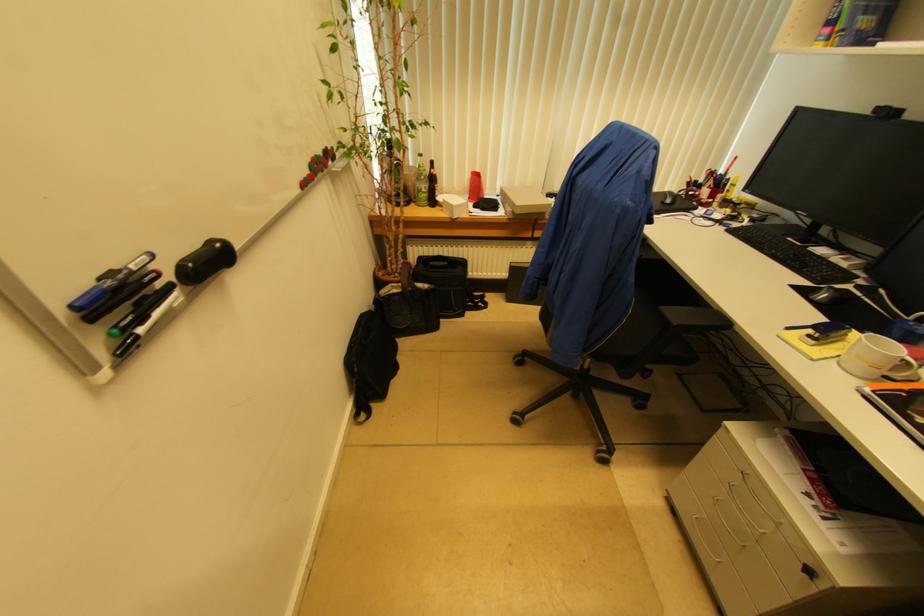
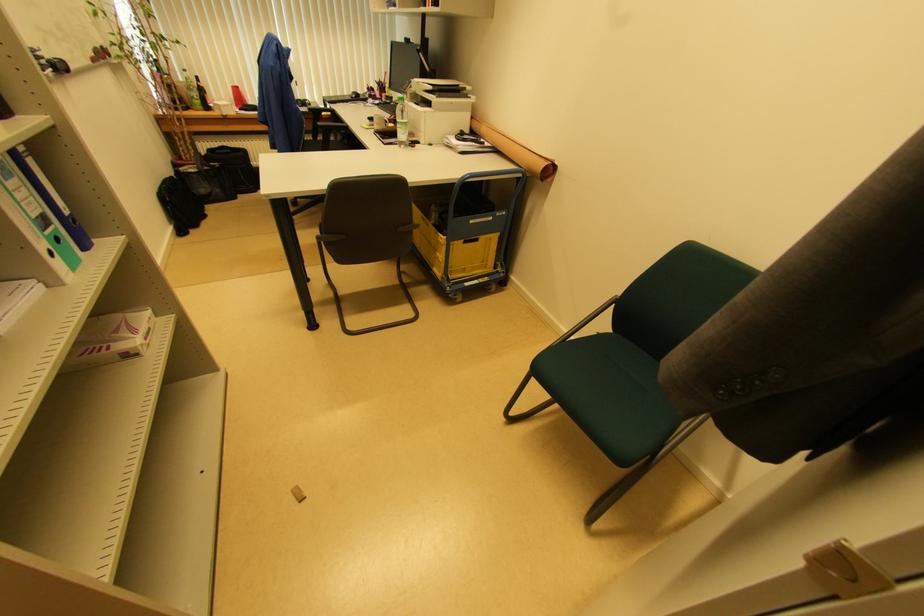
In the second image, find the point that corresponds to pixel 429 188 in the first image.

(200, 98)